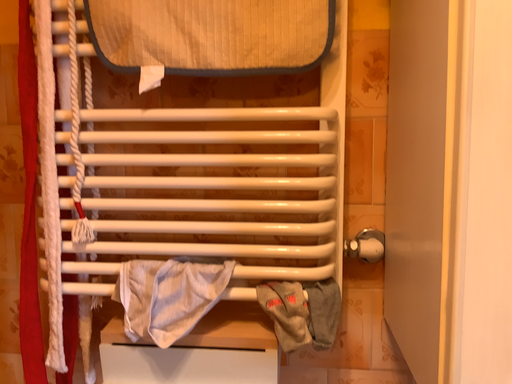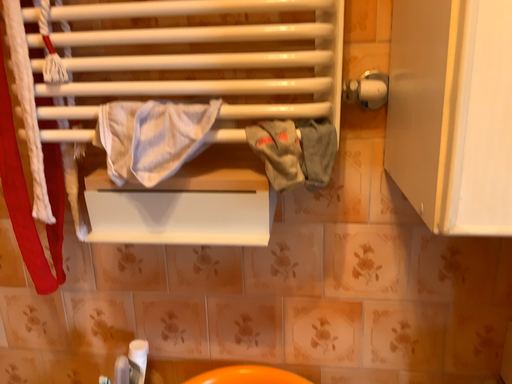
Question: Which way did the camera rotate in the video?

Choices:
 (A) rotated upward
 (B) rotated downward

Answer: (B)